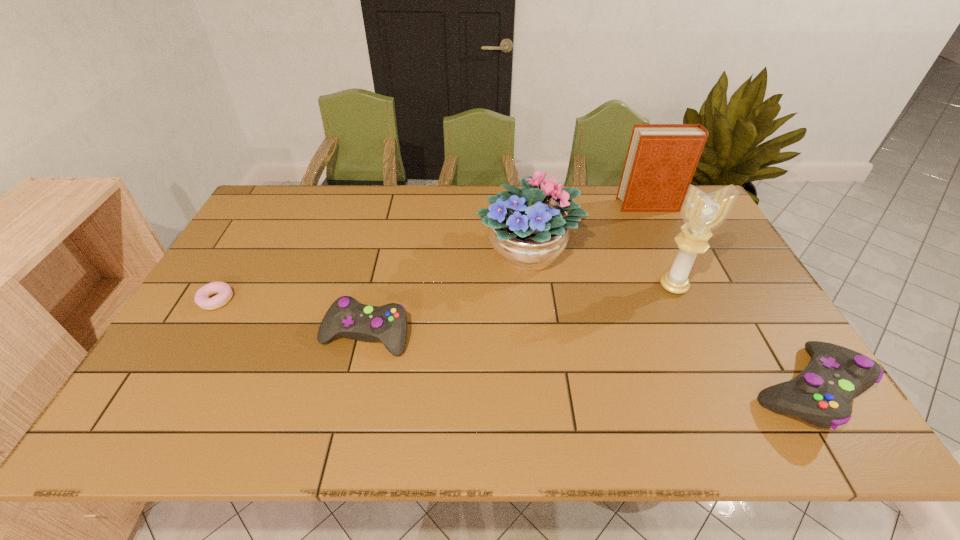
This screenshot has height=540, width=960. What are the coordinates of `free area in between the third shortest object and the second shortest object` in the screenshot? It's located at (586, 361).

Locate an element on the screen. empty location between the fourth tallest object and the award is located at coordinates 740,338.

At what (x,y) coordinates should I click in order to perform the action: click on free space between the right control and the bouquet. Please return your answer as a coordinate pair (x, y). This screenshot has width=960, height=540. Looking at the image, I should click on (667, 321).

This screenshot has height=540, width=960. Identify the location of empty space between the right control and the award. (740, 338).

Locate an element on the screen. unoccupied position between the doughnut and the bouquet is located at coordinates [372, 276].

The image size is (960, 540). What are the coordinates of `free area in between the award and the shortest object` in the screenshot? It's located at (445, 293).

Locate an element on the screen. Image resolution: width=960 pixels, height=540 pixels. blank region between the shorter control and the doughnut is located at coordinates 291,317.

Locate an element on the screen. The height and width of the screenshot is (540, 960). free space that is in between the leftmost object and the bouquet is located at coordinates (372, 276).

Locate an element on the screen. vacant area that lies between the shortest object and the bouquet is located at coordinates (372, 276).

Identify the location of object that stands as the closest to the third object from left to right. (661, 160).